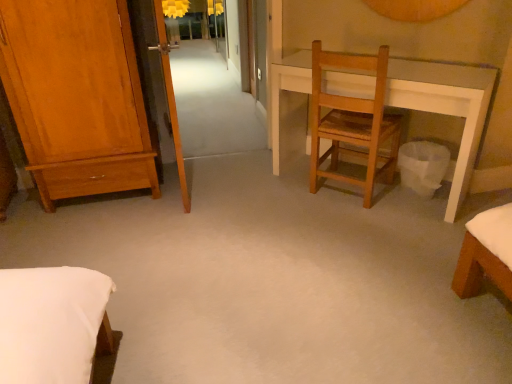
Question: From the image's perspective, relative to transparent glass screen door at upper left, is wooden chair at center above or below?

Choices:
 (A) below
 (B) above

Answer: (A)

Question: From a real-world perspective, is wooden chair at center positioned above or below transparent glass screen door at upper left?

Choices:
 (A) above
 (B) below

Answer: (B)

Question: Which of these objects is positioned closest to the matte yellow lampshade at upper center?

Choices:
 (A) shiny brown wardrobe at left
 (B) wooden chair at center
 (C) transparent glass screen door at upper left
 (D) white paper trash can at lower right

Answer: (C)

Question: Estimate the real-world distances between objects in this image. Which object is closer to the wooden chair at center?

Choices:
 (A) shiny brown wardrobe at left
 (B) transparent glass screen door at upper left
 (C) matte yellow lampshade at upper center
 (D) white paper trash can at lower right

Answer: (D)